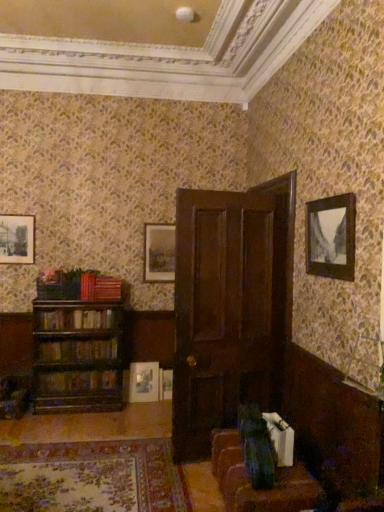
Find the location of `empty space that is ontop of wooden book at left, arranged as the 1th book when ordered from the bottom (from a real-world perspective)`. empty space that is ontop of wooden book at left, arranged as the 1th book when ordered from the bottom (from a real-world perspective) is located at coordinates (85, 369).